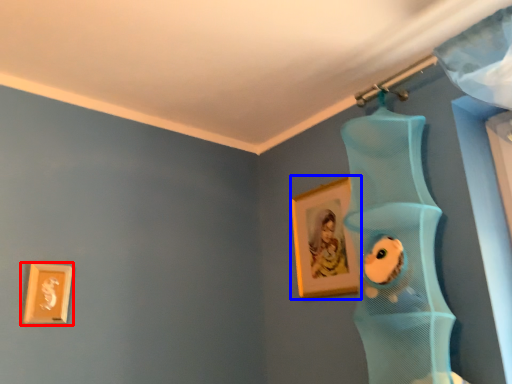
Question: Which of the following is the closest to the observer, picture frame (highlighted by a red box) or picture frame (highlighted by a blue box)?

Choices:
 (A) picture frame
 (B) picture frame

Answer: (A)